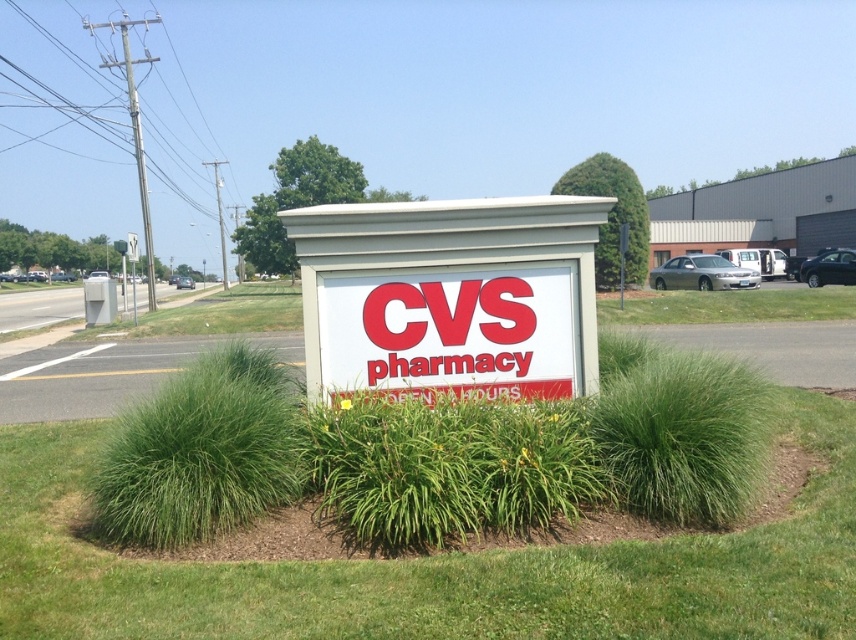
You are standing in front of the CVS Pharmacy and need to locate the green leafy grass at center and the white plastic cvs pharmacy sign at center. According to the scene, which object is positioned to the left of the other?

The green leafy grass at center is to the left of the white plastic cvs pharmacy sign at center.

You are a landscape designer who wants to ensure the green leafy grass at center and white plastic cvs pharmacy sign at center are proportionate. Based on the scene, which object is smaller and needs to be adjusted for balance?

The green leafy grass at center is smaller than the white plastic cvs pharmacy sign at center, so the grass needs to be adjusted to be larger for better balance.